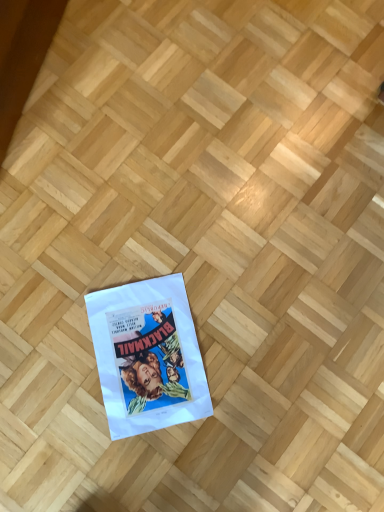
Find the location of a particular element. free space to the back side of white paper at center is located at coordinates (178, 242).